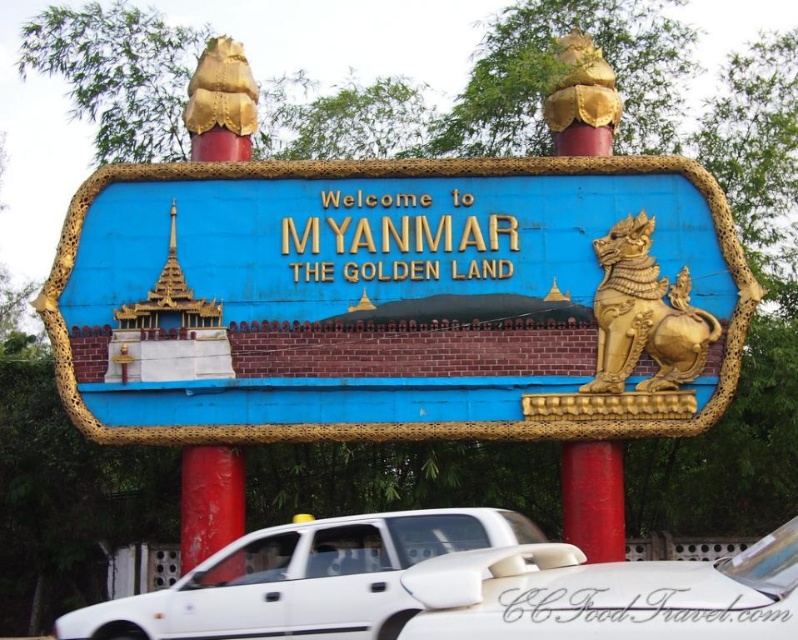
Which of these two, white matte car at lower center or gold/gilded lion at right, stands shorter?

Standing shorter between the two is white matte car at lower center.

Does point (788, 580) lie in front of point (617, 296)?

That is True.

Locate an element on the screen. white matte car at lower center is located at coordinates (605, 595).

Which is in front, point (540, 372) or point (615, 273)?

Positioned in front is point (540, 372).

Where is `blue painted wood sign at center`? This screenshot has height=640, width=798. blue painted wood sign at center is located at coordinates (394, 300).

Can you confirm if white glossy taxi at center is bigger than gold/gilded lion at right?

Indeed, white glossy taxi at center has a larger size compared to gold/gilded lion at right.

What do you see at coordinates (303, 579) in the screenshot?
I see `white glossy taxi at center` at bounding box center [303, 579].

Locate an element on the screen. white glossy taxi at center is located at coordinates (303, 579).